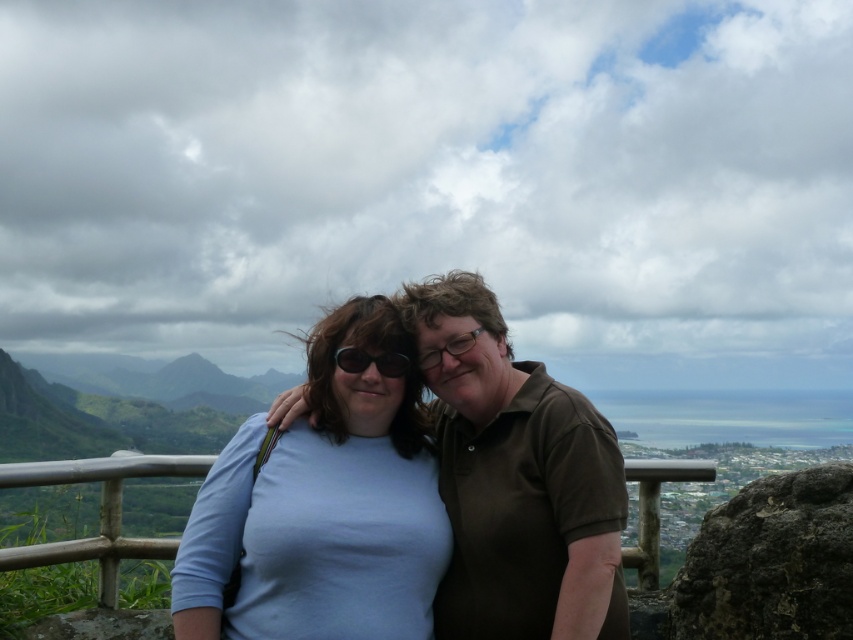
Question: Which is farther from the silver metallic rail at center?

Choices:
 (A) sunglasses at center
 (B) light blue fabric at center

Answer: (A)

Question: Which is nearer to the silver metallic rail at center?

Choices:
 (A) light blue fabric at center
 (B) sunglasses at center
 (C) brown matte shirt at center

Answer: (C)

Question: Does light blue fabric at center appear under brown matte shirt at center?

Choices:
 (A) yes
 (B) no

Answer: (A)

Question: Can you confirm if silver metallic rail at center is thinner than sunglasses at center?

Choices:
 (A) yes
 (B) no

Answer: (B)

Question: Which of the following is the closest to the observer?

Choices:
 (A) (317, 509)
 (B) (555, 388)
 (C) (102, 589)

Answer: (A)

Question: Is brown matte shirt at center further to the viewer compared to sunglasses at center?

Choices:
 (A) yes
 (B) no

Answer: (B)